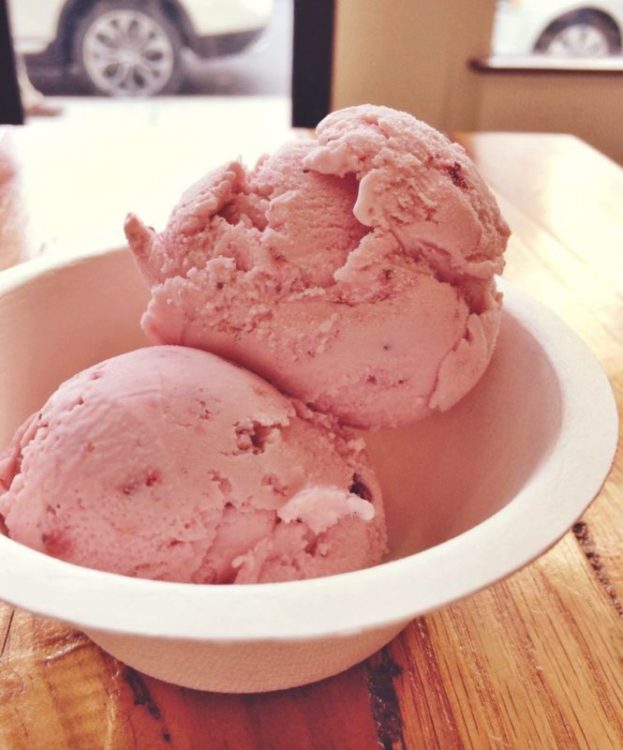
Locate an element on the screen. The width and height of the screenshot is (623, 750). brown table is located at coordinates (541, 673).